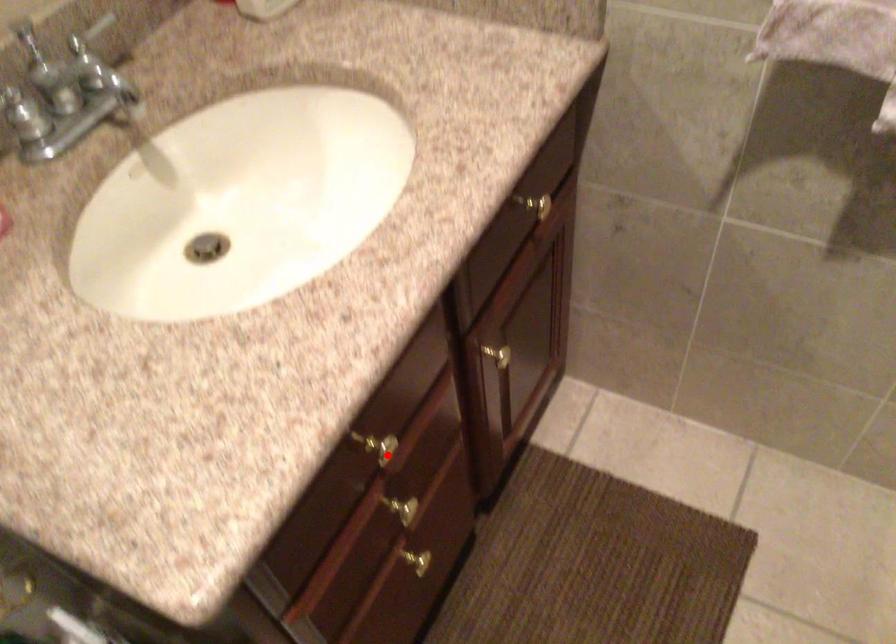
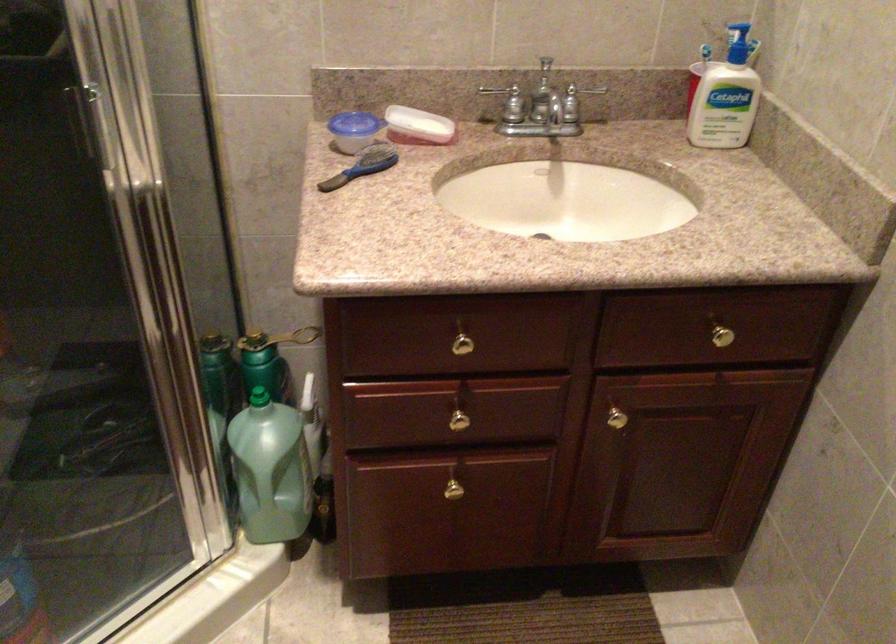
Where in the second image is the point corresponding to the highlighted location from the first image?

(462, 348)